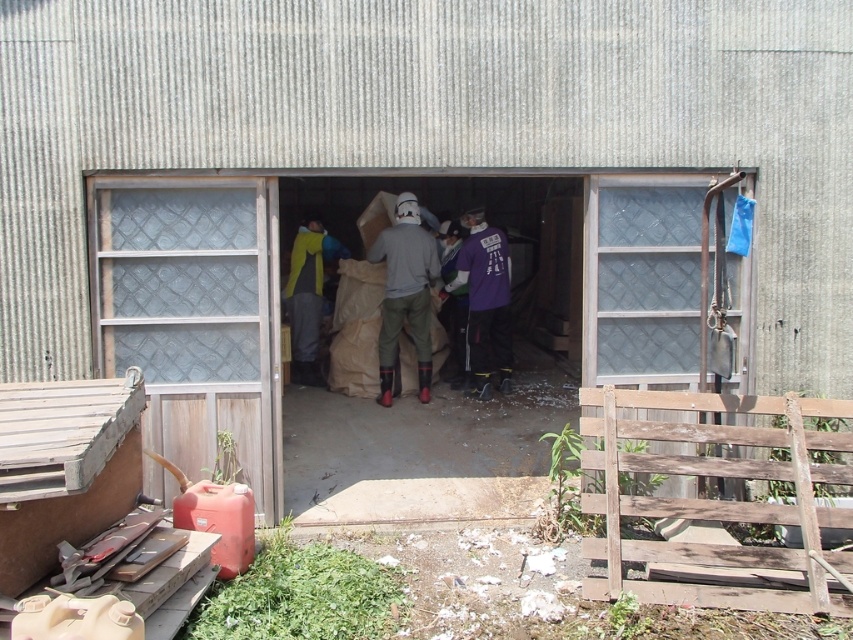
Who is lower down, purple matte shirt at center or purple fabric at center?

purple fabric at center

This screenshot has height=640, width=853. What are the coordinates of `purple matte shirt at center` in the screenshot? It's located at (485, 301).

Who is more distant from viewer, (392, 248) or (312, 243)?

Positioned behind is point (312, 243).

Can you confirm if matte gray sweatshirt at center is positioned above yellow fabric jacket at center?

Yes.

What do you see at coordinates (405, 294) in the screenshot? I see `matte gray sweatshirt at center` at bounding box center [405, 294].

What are the coordinates of `matte gray sweatshirt at center` in the screenshot? It's located at (405, 294).

Describe the element at coordinates (192, 317) in the screenshot. I see `clear glass door at left` at that location.

Can you confirm if clear glass door at left is taller than yellow fabric jacket at center?

Yes.

In order to click on clear glass door at left in this screenshot , I will do tap(192, 317).